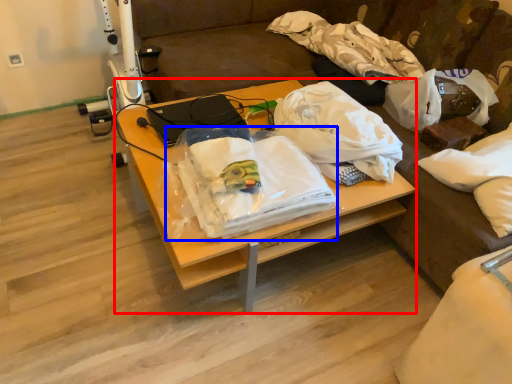
Question: Which of the following is the farthest to the observer, desk (highlighted by a red box) or cloth (highlighted by a blue box)?

Choices:
 (A) desk
 (B) cloth

Answer: (A)